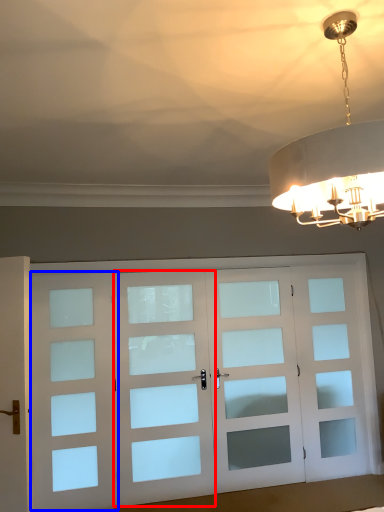
Question: Which point is closer to the camera, screen door (highlighted by a red box) or screen door (highlighted by a blue box)?

Choices:
 (A) screen door
 (B) screen door

Answer: (B)